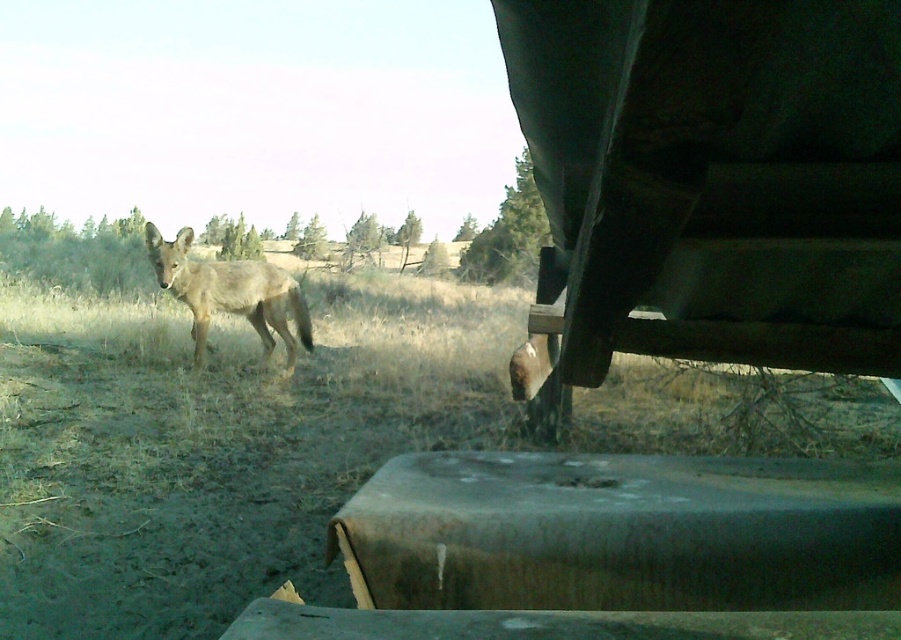
Which is more to the right, dry grass at center or fuzzy brown coyote at center?

From the viewer's perspective, dry grass at center appears more on the right side.

Which of these two, dry grass at center or fuzzy brown coyote at center, stands shorter?

fuzzy brown coyote at center is shorter.

Is point (370, 442) closer to camera compared to point (276, 273)?

Yes.

Image resolution: width=901 pixels, height=640 pixels. I want to click on dry grass at center, so click(x=299, y=438).